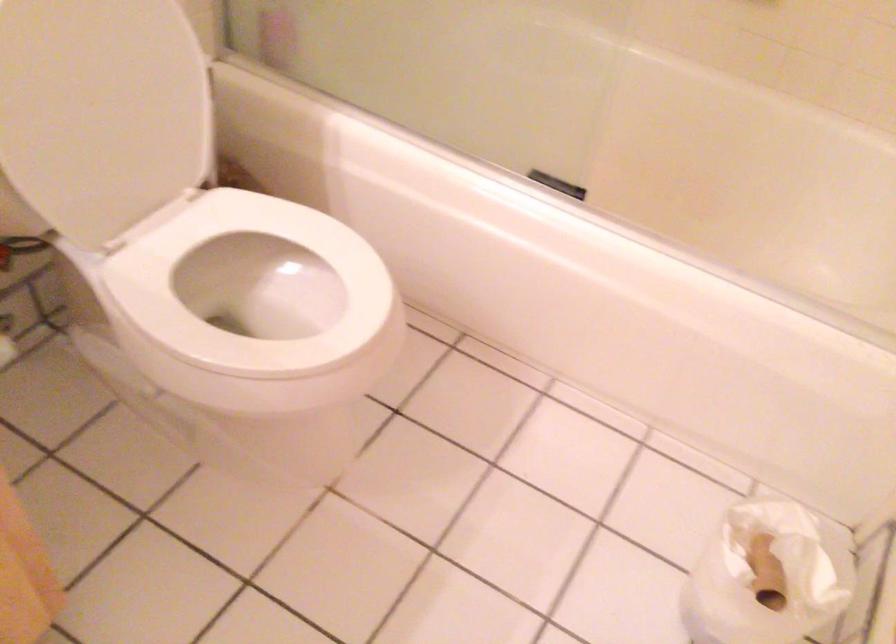
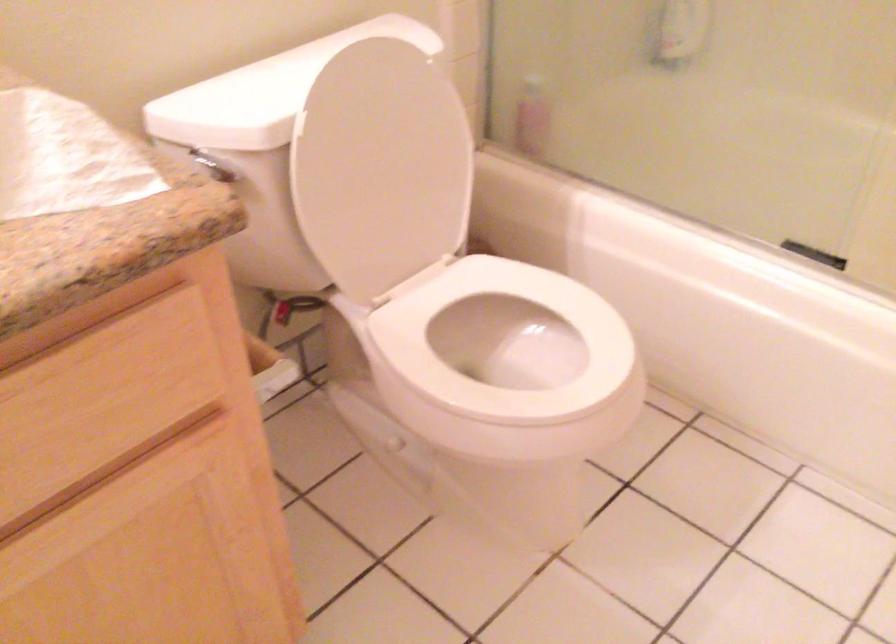
Where in the second image is the point corresponding to (x=108, y=97) from the first image?

(381, 167)